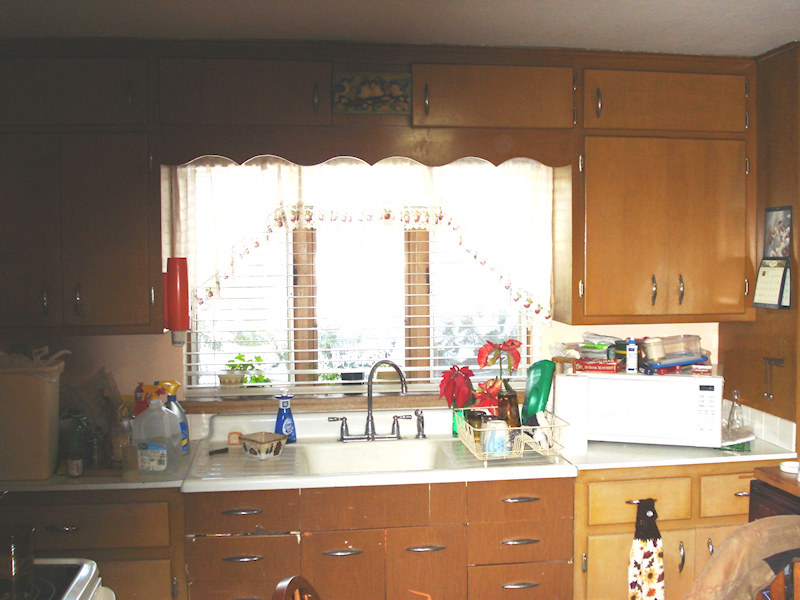
Image resolution: width=800 pixels, height=600 pixels. Identify the location of green dishwasher detergent bottle. (533, 389).